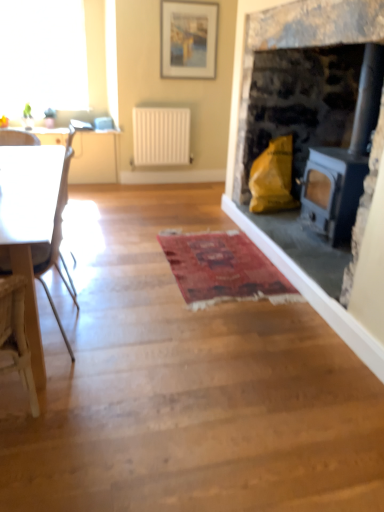
Question: From the image's perspective, is matte white picture frame at upper center beneath white matte radiator at center?

Choices:
 (A) no
 (B) yes

Answer: (A)

Question: Is matte white picture frame at upper center at the left side of white matte radiator at center?

Choices:
 (A) yes
 (B) no

Answer: (B)

Question: Can you confirm if matte white picture frame at upper center is thinner than white matte radiator at center?

Choices:
 (A) yes
 (B) no

Answer: (A)

Question: Is matte white picture frame at upper center aimed at white matte radiator at center?

Choices:
 (A) no
 (B) yes

Answer: (A)

Question: From a real-world perspective, is matte white picture frame at upper center under white matte radiator at center?

Choices:
 (A) no
 (B) yes

Answer: (A)

Question: Is matte white picture frame at upper center turned away from white matte radiator at center?

Choices:
 (A) yes
 (B) no

Answer: (B)

Question: Can transparent glass window at upper left be found inside white glossy table at left?

Choices:
 (A) no
 (B) yes

Answer: (A)

Question: Is white glossy table at left not close to transparent glass window at upper left?

Choices:
 (A) no
 (B) yes

Answer: (B)

Question: From the image's perspective, does white glossy table at left appear higher than transparent glass window at upper left?

Choices:
 (A) yes
 (B) no

Answer: (B)

Question: Are white glossy table at left and transparent glass window at upper left making contact?

Choices:
 (A) yes
 (B) no

Answer: (B)

Question: Could you tell me if white glossy table at left is facing transparent glass window at upper left?

Choices:
 (A) no
 (B) yes

Answer: (A)

Question: Is white glossy table at left not within transparent glass window at upper left?

Choices:
 (A) yes
 (B) no

Answer: (A)

Question: Is the depth of white glossy countertop at upper left greater than that of white matte radiator at center?

Choices:
 (A) no
 (B) yes

Answer: (A)